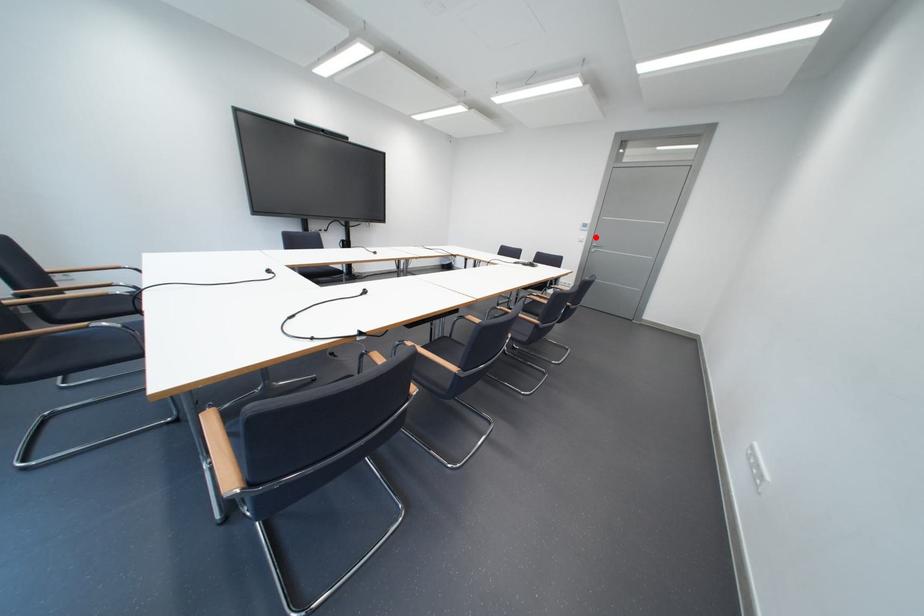
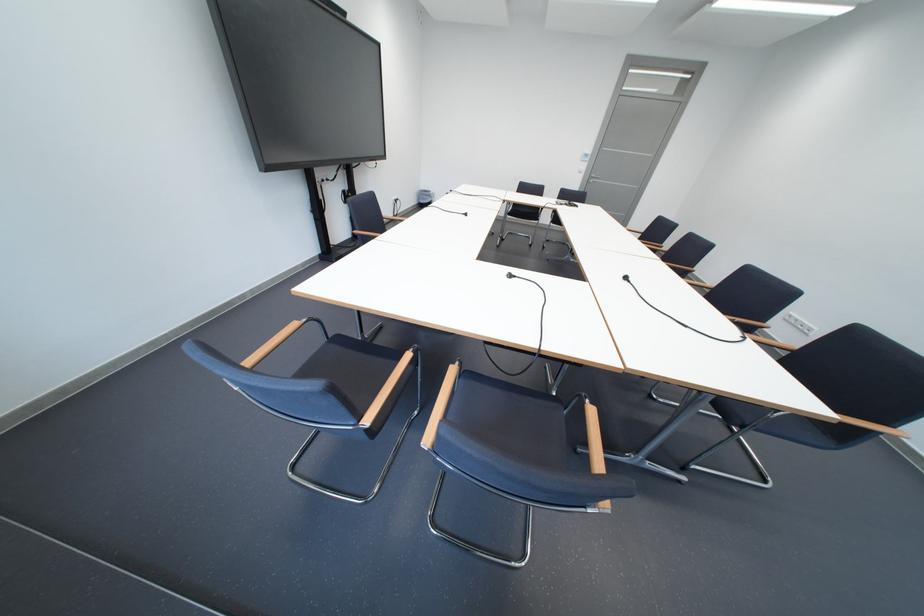
Question: I am providing you with two images of the same scene from different viewpoints. Image1 has a red point marked. In image2, the corresponding 3D location appears at what relative position? Reply with the corresponding letter.

Choices:
 (A) Closer
 (B) Farther

Answer: (A)